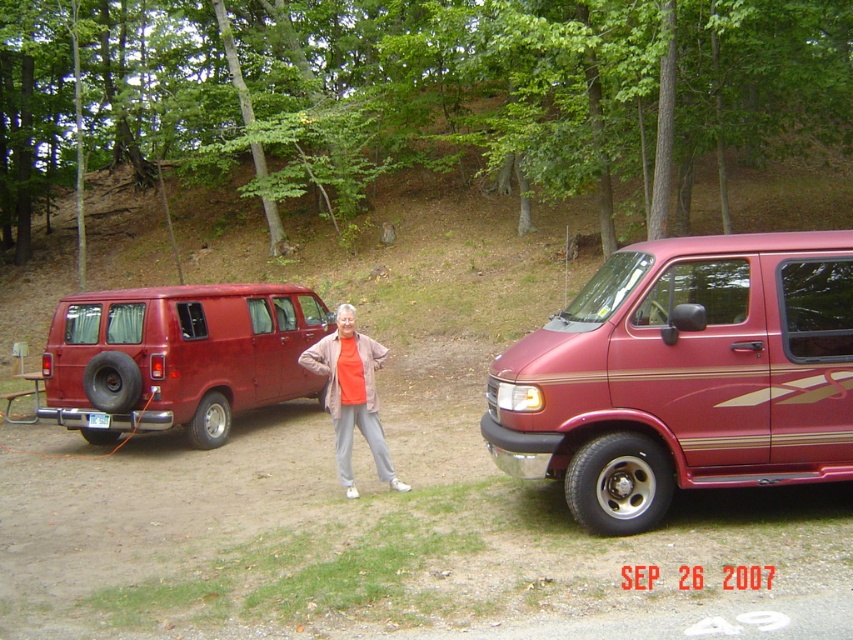
You are a photographer trying to capture a photo of both the shiny maroon van at center and the matte red van at left. Based on their positions, which van should you focus on first to ensure both are in frame without moving the camera?

Since the shiny maroon van at center is above the matte red van at left, you should focus on the matte red van at left first to ensure both are in frame without moving the camera.

You are a photographer trying to capture a clear shot of the shiny maroon van at center and the orange fabric jacket at center. Since the van is blocking part of the jacket, how should you adjust your position to ensure both are fully visible?

The shiny maroon van at center is in front of the orange fabric jacket at center, so you should move your camera position to the side of the van to avoid blocking the jacket.